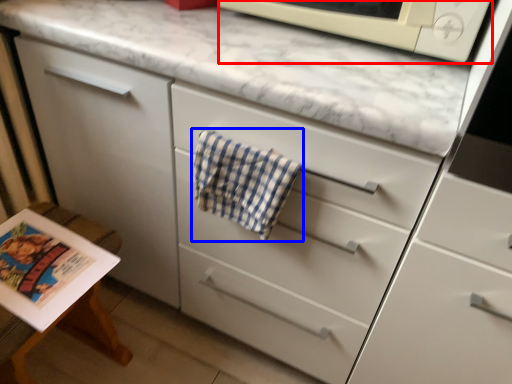
Question: Among these objects, which one is farthest to the camera, microwave oven (highlighted by a red box) or beach towel (highlighted by a blue box)?

Choices:
 (A) microwave oven
 (B) beach towel

Answer: (B)